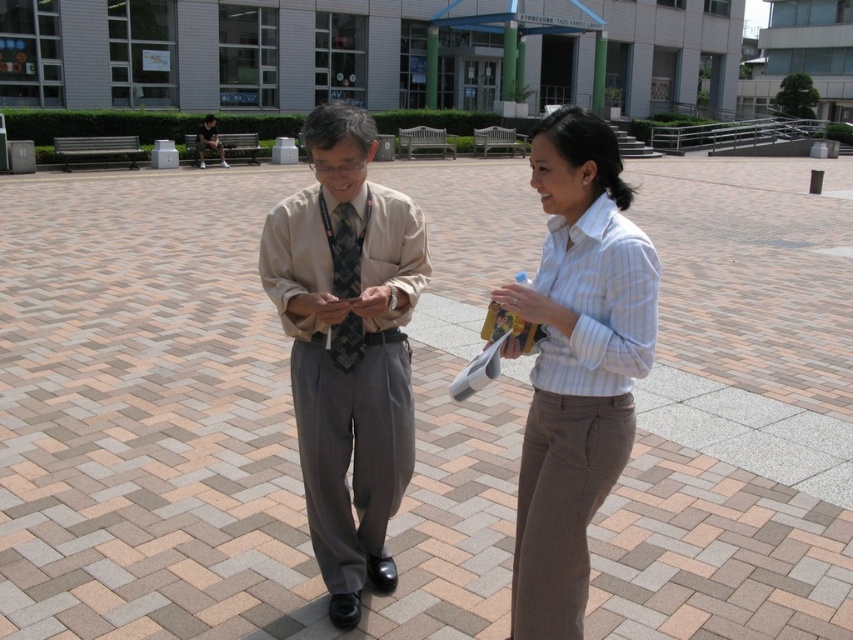
Who is positioned more to the left, matte beige shirt at center or dark gray textured tie at center?

Positioned to the left is matte beige shirt at center.

Does matte beige shirt at center have a greater height compared to dark gray textured tie at center?

Yes.

Does point (345, 460) lie in front of point (340, 369)?

No, it is not.

Identify the location of matte beige shirt at center. This screenshot has width=853, height=640. (347, 346).

Who is higher up, light brown fabric shirt at center or matte beige shirt at center?

Positioned higher is matte beige shirt at center.

From the picture: Who is taller, light brown fabric shirt at center or matte beige shirt at center?

matte beige shirt at center

Is point (552, 198) less distant than point (338, 188)?

Yes, it is.

I want to click on light brown fabric shirt at center, so click(x=576, y=364).

Who is more forward, (503, 298) or (350, 339)?

Point (503, 298)

Does point (575, 595) come in front of point (337, 252)?

Yes, point (575, 595) is closer to viewer.

Locate an element on the screen. striped cotton shirt at center is located at coordinates (576, 364).